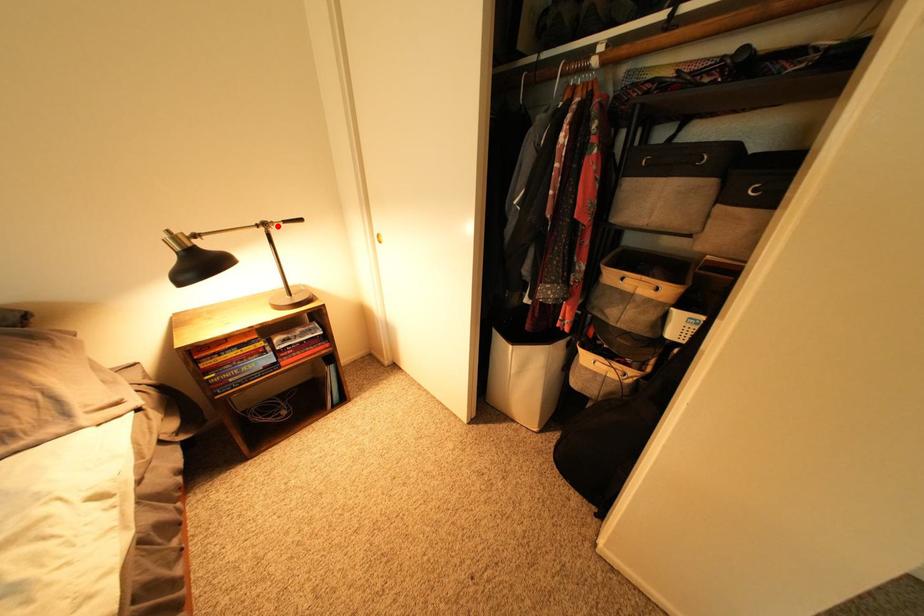
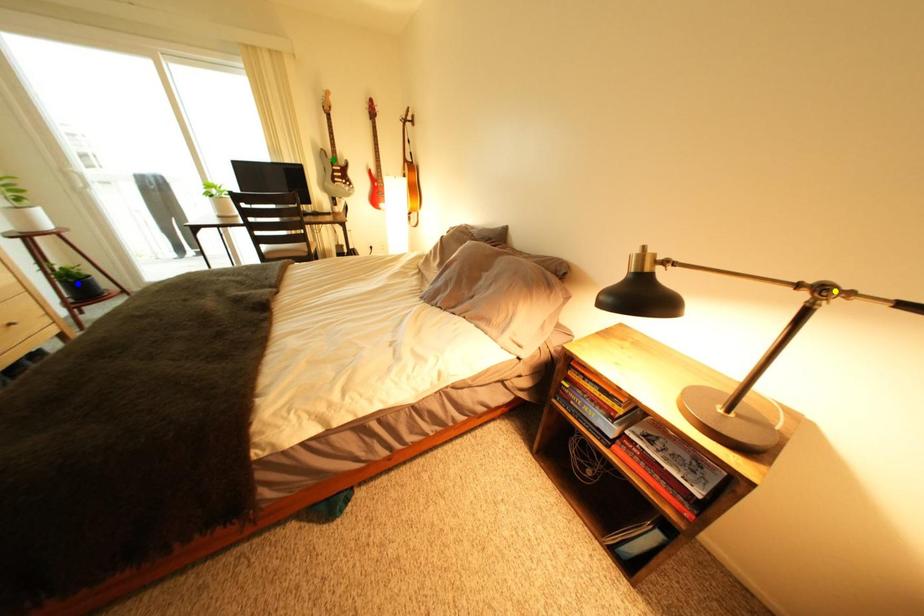
Question: I am providing you with two images of the same scene from different viewpoints. A red point is marked on the first image. You are given multiple points on the second image. Which point in image 2 represents the same 3d spot as the red point in image 1?

Choices:
 (A) yellow point
 (B) green point
 (C) blue point

Answer: (A)